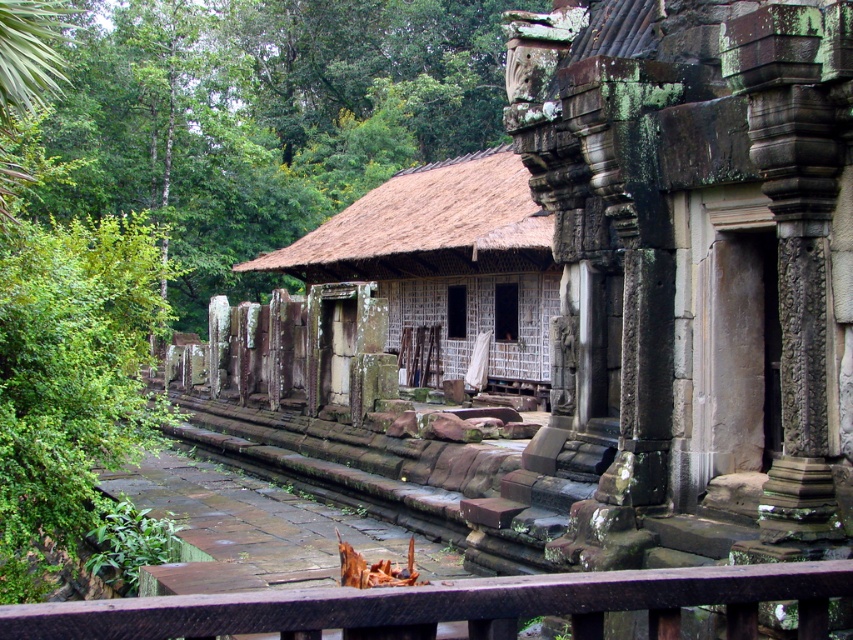
You are standing in front of an ancient stone temple surrounded by greenery. There is a point labeled as point (258,118). Based on the scene description, what does this point most likely represent?

The point (258,118) corresponds to green leafy vegetation at center.